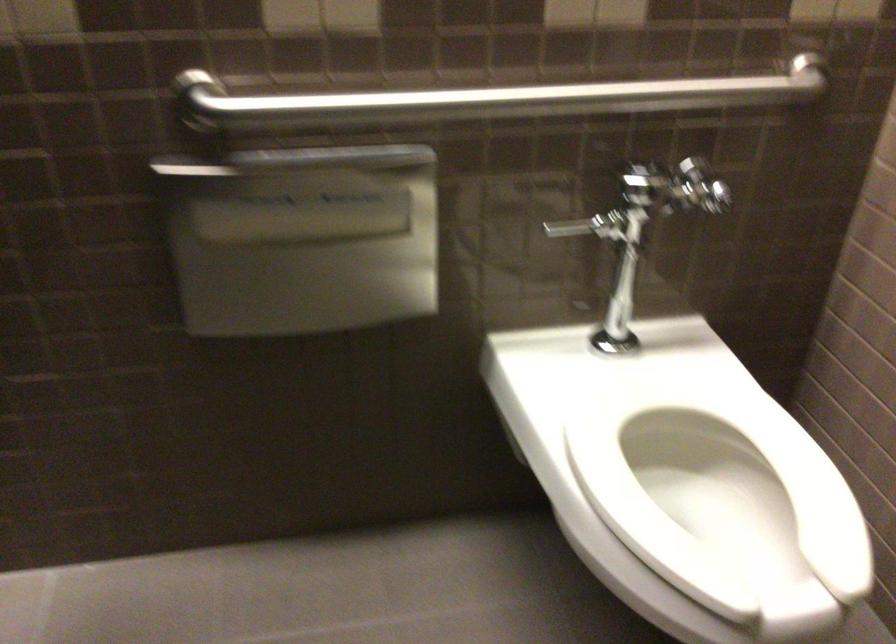
Locate an element on the screen. Image resolution: width=896 pixels, height=644 pixels. white toilet seat is located at coordinates (719, 494).